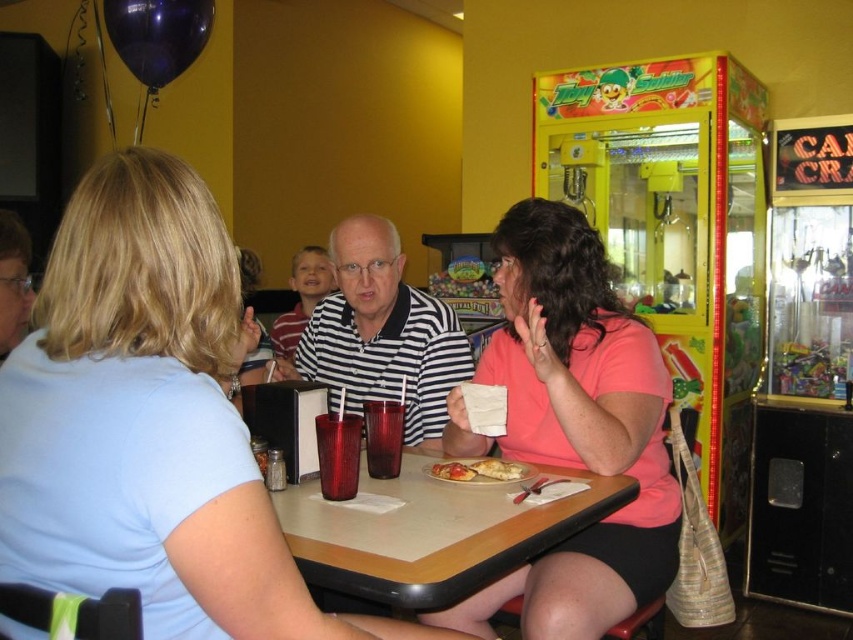
Is light blue shirt at center positioned at the back of golden crispy pastry at center?

No, it is in front of golden crispy pastry at center.

Who is more forward, (440, 637) or (466, 477)?

Positioned in front is point (440, 637).

In order to click on light blue shirt at center in this screenshot , I will do `click(148, 422)`.

Is striped shirt at center below golden crispy pastry at center?

Incorrect, striped shirt at center is not positioned below golden crispy pastry at center.

Is striped shirt at center further to camera compared to golden crispy pastry at center?

Yes, it is.

Find the location of a particular element. This screenshot has width=853, height=640. striped shirt at center is located at coordinates [381, 333].

You are a GUI agent. You are given a task and a screenshot of the screen. Output one action in this format:
    pyautogui.click(x=<x>, y=<y>)
    Task: Click on the striped shirt at center
    
    Given the screenshot: What is the action you would take?
    point(381,333)

Which is above, light blue shirt at center or pink matte shirt at center?

pink matte shirt at center is above.

Locate an element on the screen. This screenshot has width=853, height=640. light blue shirt at center is located at coordinates (148, 422).